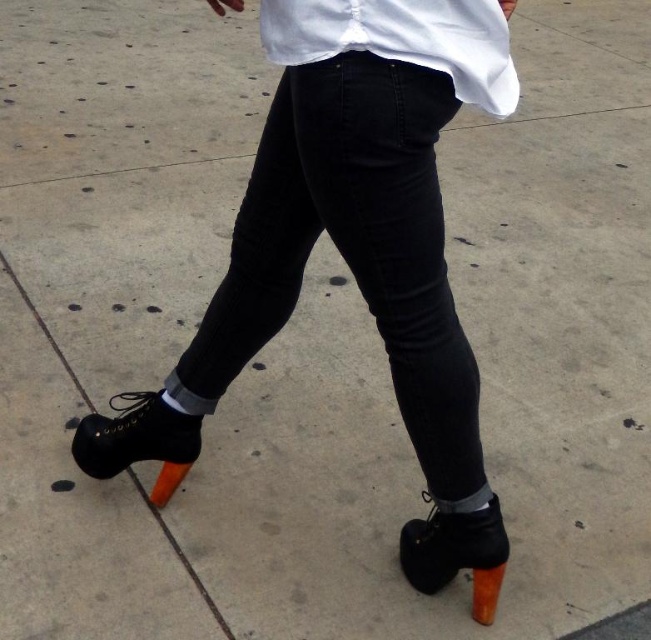
Does black leather shoe at lower left appear on the right side of orange matte high-heeled shoe at lower center?

No, black leather shoe at lower left is not to the right of orange matte high-heeled shoe at lower center.

Is black leather shoe at lower left shorter than orange matte high-heeled shoe at lower center?

Indeed, black leather shoe at lower left has a lesser height compared to orange matte high-heeled shoe at lower center.

Between point (105, 461) and point (503, 547), which one is positioned in front?

Point (503, 547)

Locate an element on the screen. The width and height of the screenshot is (651, 640). black leather shoe at lower left is located at coordinates (139, 440).

Does black denim jeans at center have a greater width compared to orange matte heel at lower right?

Indeed, black denim jeans at center has a greater width compared to orange matte heel at lower right.

Can you confirm if black denim jeans at center is positioned to the left of orange matte heel at lower right?

Indeed, black denim jeans at center is positioned on the left side of orange matte heel at lower right.

Which is behind, point (413, 444) or point (490, 577)?

Positioned behind is point (490, 577).

You are a GUI agent. You are given a task and a screenshot of the screen. Output one action in this format:
    pyautogui.click(x=<x>, y=<y>)
    Task: Click on the black denim jeans at center
    
    Given the screenshot: What is the action you would take?
    pyautogui.click(x=352, y=250)

Who is lower down, orange matte high-heeled shoe at lower center or orange matte heel at lower right?

orange matte heel at lower right

Can you confirm if orange matte high-heeled shoe at lower center is wider than orange matte heel at lower right?

Correct, the width of orange matte high-heeled shoe at lower center exceeds that of orange matte heel at lower right.

Is point (419, 586) closer to viewer compared to point (480, 621)?

No, (419, 586) is behind (480, 621).

This screenshot has height=640, width=651. I want to click on orange matte high-heeled shoe at lower center, so click(458, 554).